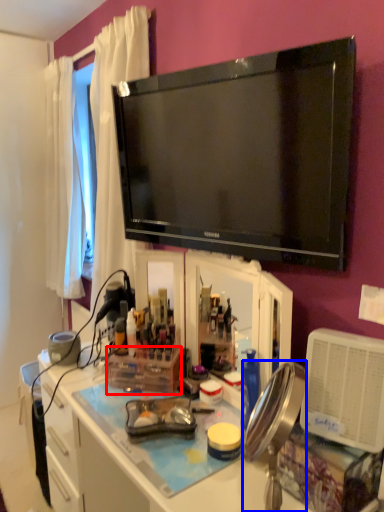
Question: Which of the following is the closest to the observer, box (highlighted by a red box) or mirror (highlighted by a blue box)?

Choices:
 (A) box
 (B) mirror

Answer: (B)